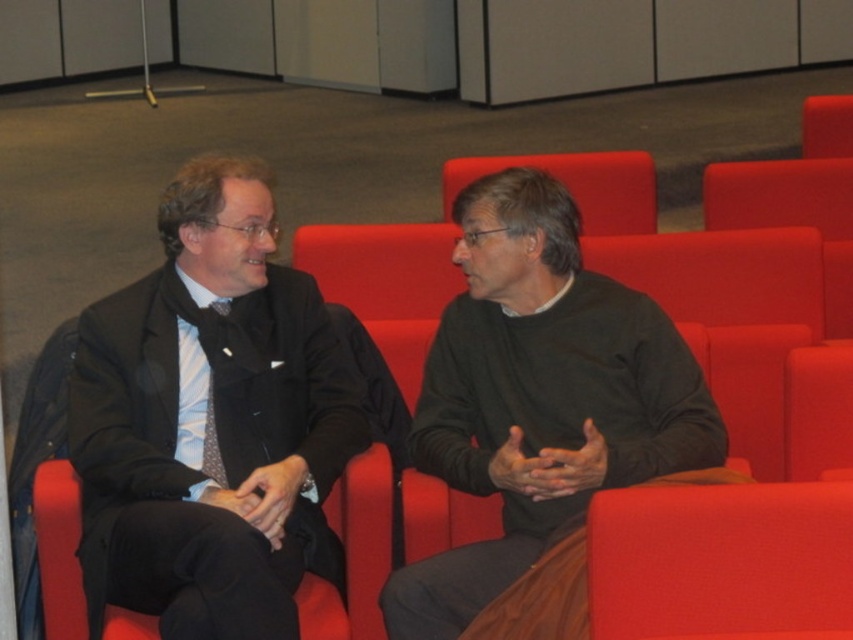
You are attending a formal event and need to sit between the matte black suit at center and the dark green sweater at center. Which direction should you move to sit between them?

Since the matte black suit at center is to the left of the dark green sweater at center, you should move to the right of the matte black suit at center and to the left of the dark green sweater at center to sit between them.

You are standing in the auditorium and want to reach the point marked as point (73, 456). If you walk straight ahead, how far will you have to walk to reach that point?

The distance between you and point (73, 456) is 2.53 meters, so you will have to walk 2.53 meters straight ahead to reach it.